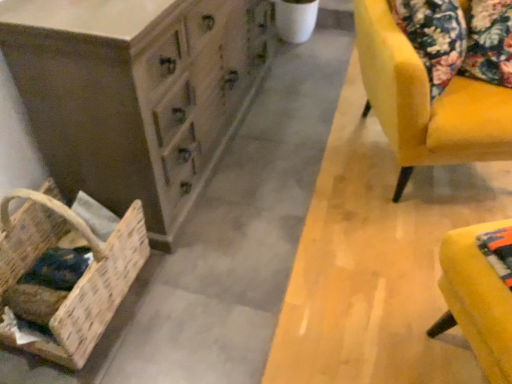
Identify the location of spots to the right of wooden chest of drawers at lower left. The width and height of the screenshot is (512, 384). (297, 150).